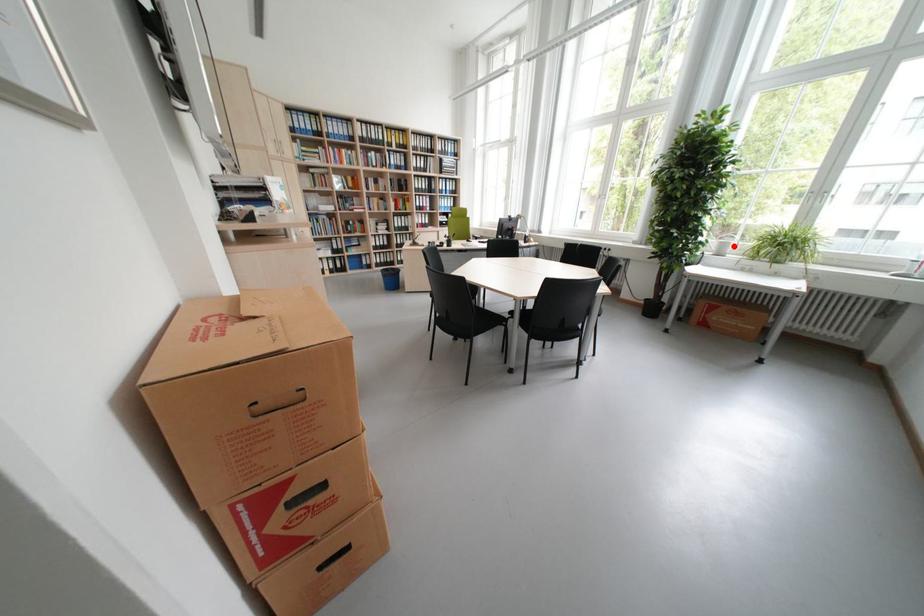
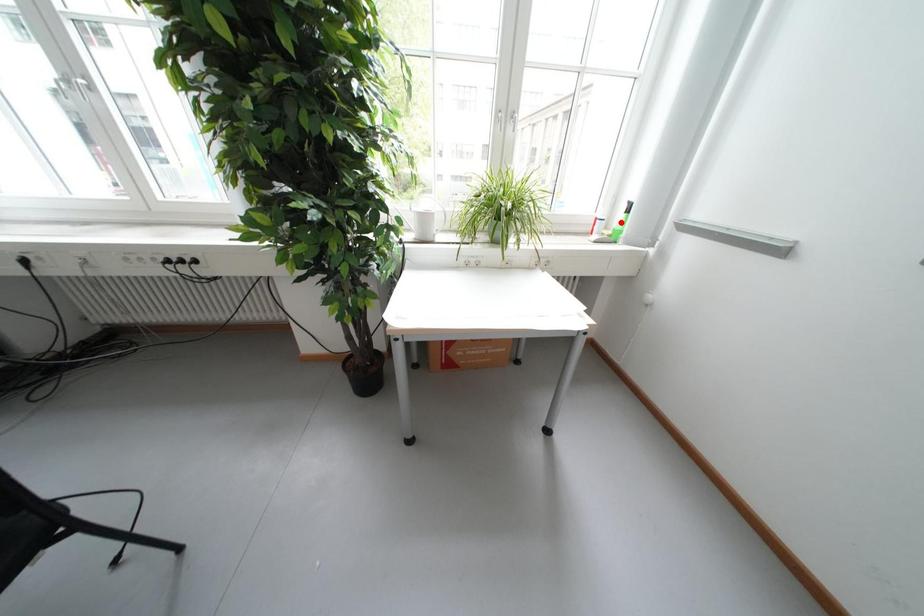
I am providing you with two images of the same scene from different viewpoints. A red point is marked on the first image and another point is marked on the second image. Are the points marked in image1 and image2 representing the same 3D position?

No